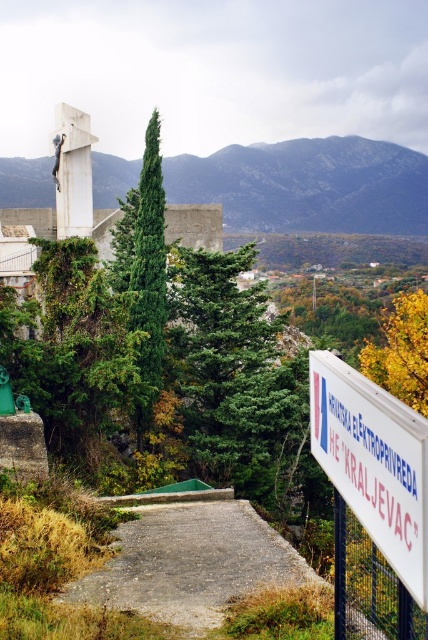
Does green matte tree at center appear on the left side of gray concrete path at center?

No, green matte tree at center is not to the left of gray concrete path at center.

Between green matte tree at center and gray concrete path at center, which one is positioned lower?

gray concrete path at center

Is point (171, 321) positioned before point (250, 593)?

No, it is behind (250, 593).

You are a GUI agent. You are given a task and a screenshot of the screen. Output one action in this format:
    pyautogui.click(x=<x>, y=<y>)
    Task: Click on the green matte tree at center
    The width and height of the screenshot is (428, 640).
    Given the screenshot: What is the action you would take?
    pyautogui.click(x=231, y=372)

Is green matte tree at center below yellow leafy tree at right?

No.

The image size is (428, 640). What are the coordinates of `green matte tree at center` in the screenshot? It's located at (231, 372).

Between gray concrete path at center and metallic wire mesh at lower right, which one is positioned lower?

Positioned lower is gray concrete path at center.

Is point (165, 522) positioned after point (380, 566)?

Yes, point (165, 522) is farther from viewer.

Is point (231, 566) less distant than point (372, 556)?

No, (231, 566) is behind (372, 556).

The height and width of the screenshot is (640, 428). Find the location of `gray concrete path at center`. gray concrete path at center is located at coordinates (193, 563).